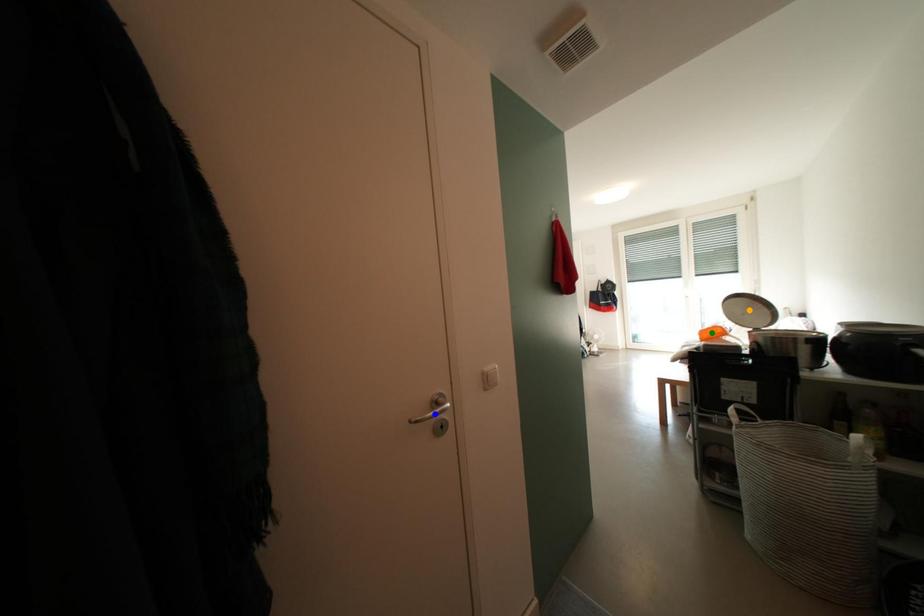
Order these from nearest to farthest:
blue point
green point
orange point

1. orange point
2. green point
3. blue point